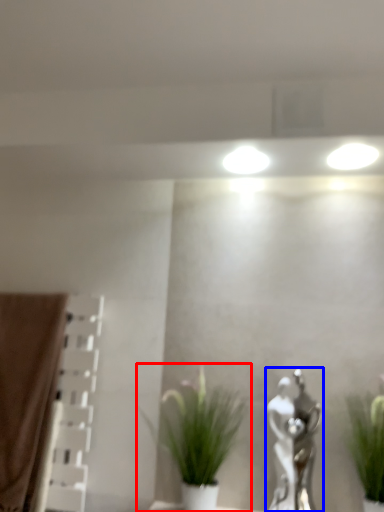
Question: Which point is closer to the camera, houseplant (highlighted by a red box) or art (highlighted by a blue box)?

Choices:
 (A) houseplant
 (B) art

Answer: (A)